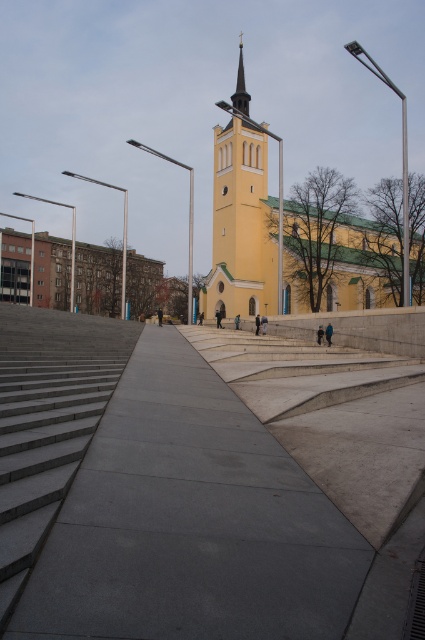
Question: Which object is closer to the camera taking this photo?

Choices:
 (A) polished gold spire at center
 (B) gray concrete stairs at center
 (C) yellow matte church at center

Answer: (B)

Question: Which object appears closest to the camera in this image?

Choices:
 (A) gray concrete pavement at center
 (B) yellow matte tower at center
 (C) gray concrete stairs at center
 (D) polished gold spire at center

Answer: (A)

Question: Can you confirm if yellow matte church at center is smaller than polished gold spire at center?

Choices:
 (A) no
 (B) yes

Answer: (A)

Question: Can you confirm if yellow matte church at center is wider than yellow matte tower at center?

Choices:
 (A) no
 (B) yes

Answer: (A)

Question: Is yellow matte church at center below polished gold spire at center?

Choices:
 (A) no
 (B) yes

Answer: (B)

Question: Which of these objects is positioned farthest from the polished gold spire at center?

Choices:
 (A) yellow matte church at center
 (B) gray concrete stairs at center
 (C) yellow matte tower at center

Answer: (B)